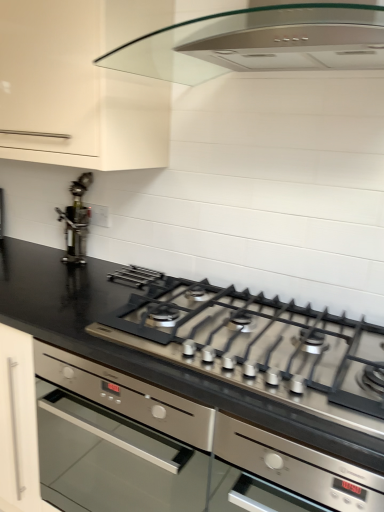
Question: From the image's perspective, is black glossy countertop at center located above matte white cabinet at upper left?

Choices:
 (A) yes
 (B) no

Answer: (B)

Question: Is matte white cabinet at upper left located within black glossy countertop at center?

Choices:
 (A) yes
 (B) no

Answer: (B)

Question: Is black glossy countertop at center located outside matte white cabinet at upper left?

Choices:
 (A) no
 (B) yes

Answer: (B)

Question: Is black glossy countertop at center looking in the opposite direction of matte white cabinet at upper left?

Choices:
 (A) no
 (B) yes

Answer: (A)

Question: From the image's perspective, is black glossy countertop at center beneath matte white cabinet at upper left?

Choices:
 (A) yes
 (B) no

Answer: (A)

Question: Is matte white cabinet at upper left in front of or behind satin silver gas stove at center in the image?

Choices:
 (A) front
 (B) behind

Answer: (B)

Question: In the image, is matte white cabinet at upper left on the left side or the right side of satin silver gas stove at center?

Choices:
 (A) left
 (B) right

Answer: (A)

Question: Considering the positions of point (41, 40) and point (334, 331), is point (41, 40) closer or farther from the camera than point (334, 331)?

Choices:
 (A) farther
 (B) closer

Answer: (A)

Question: From a real-world perspective, is matte white cabinet at upper left above or below satin silver gas stove at center?

Choices:
 (A) above
 (B) below

Answer: (A)

Question: Is matte white cabinet at upper left taller or shorter than stainless steel at left?

Choices:
 (A) tall
 (B) short

Answer: (A)

Question: Which is correct: matte white cabinet at upper left is inside stainless steel at left, or outside of it?

Choices:
 (A) inside
 (B) outside

Answer: (B)

Question: From a real-world perspective, is matte white cabinet at upper left positioned above or below stainless steel at left?

Choices:
 (A) above
 (B) below

Answer: (A)

Question: Relative to stainless steel at left, is matte white cabinet at upper left in front or behind?

Choices:
 (A) front
 (B) behind

Answer: (A)

Question: In the image, is stainless steel at left positioned in front of or behind satin silver gas stove at center?

Choices:
 (A) front
 (B) behind

Answer: (B)

Question: Is stainless steel at left bigger or smaller than satin silver gas stove at center?

Choices:
 (A) small
 (B) big

Answer: (A)